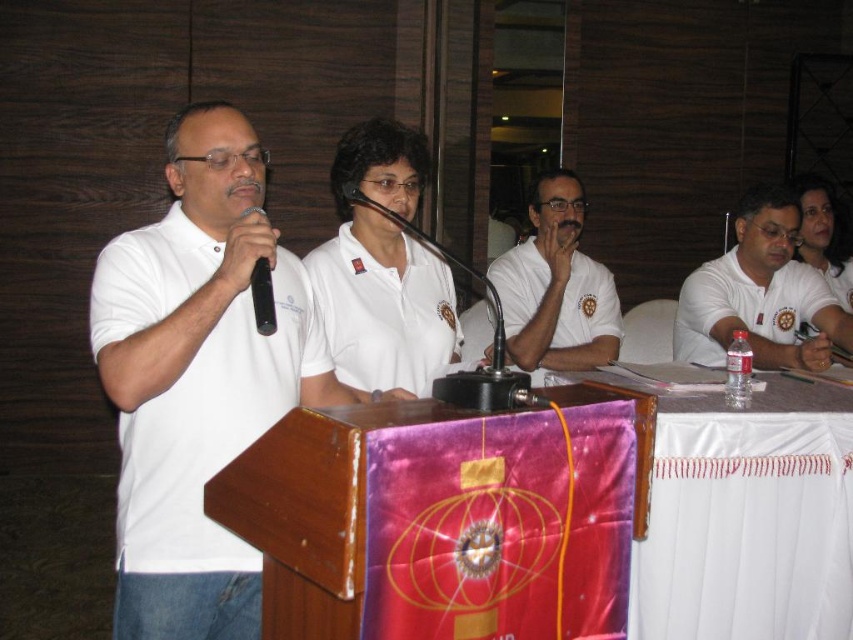
You are an attendee at this event and want to ask a question to the speaker. To do so, you need to approach the podium and grab the microphone. Based on the scene, can you reach the black plastic microphone at left without moving the white matte polo shirt at left?

The black plastic microphone at left is behind the white matte polo shirt at left, so you cannot reach it without moving the white matte polo shirt at left.

You are a photographer at the event and need to adjust your camera to focus on the white matte polo shirt at left. What are the coordinates where you should aim your camera?

The coordinates for the white matte polo shirt at left are at point (212,429).